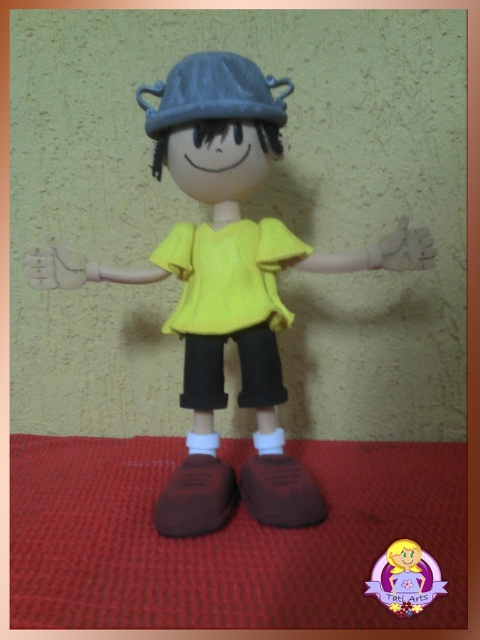
Question: Which is nearer to the matte yellow shirt at center?

Choices:
 (A) matte plastic hand at left
 (B) matte yellow fabric shirt at center
 (C) matte gray baseball hat at upper center
 (D) yellow matte shirt at center

Answer: (B)

Question: Based on their relative distances, which object is nearer to the matte yellow fabric shirt at center?

Choices:
 (A) brown matte hand at center
 (B) matte plastic hand at left

Answer: (B)

Question: Which point appears closest to the camera in this image?

Choices:
 (A) 418,576
 (B) 268,381

Answer: (A)

Question: Can you confirm if matte yellow fabric shirt at center is positioned below yellow matte shirt at center?

Choices:
 (A) yes
 (B) no

Answer: (A)

Question: Is the position of matte yellow fabric shirt at center more distant than that of matte yellow shirt at center?

Choices:
 (A) yes
 (B) no

Answer: (A)

Question: Considering the relative positions of yellow matte shirt at center and matte brown hand at center in the image provided, where is yellow matte shirt at center located with respect to matte brown hand at center?

Choices:
 (A) below
 (B) above

Answer: (B)